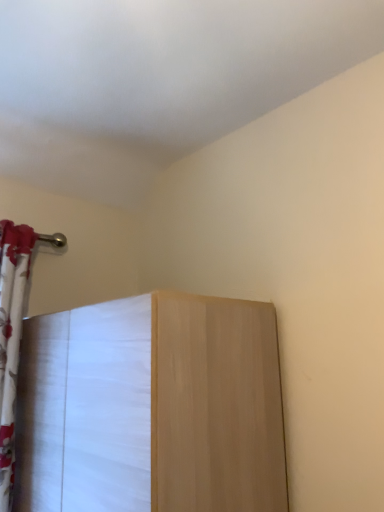
Question: From a real-world perspective, is light wood cabinet at center physically located above or below white floral fabric curtain at left?

Choices:
 (A) above
 (B) below

Answer: (B)

Question: From the image's perspective, is light wood cabinet at center located above or below white floral fabric curtain at left?

Choices:
 (A) below
 (B) above

Answer: (A)

Question: Is light wood cabinet at center situated inside white floral fabric curtain at left or outside?

Choices:
 (A) outside
 (B) inside

Answer: (A)

Question: Considering their positions, is white floral fabric curtain at left located in front of or behind light wood cabinet at center?

Choices:
 (A) behind
 (B) front

Answer: (A)

Question: Based on their positions, is white floral fabric curtain at left located to the left or right of light wood cabinet at center?

Choices:
 (A) left
 (B) right

Answer: (A)

Question: Would you say white floral fabric curtain at left is inside or outside light wood cabinet at center?

Choices:
 (A) inside
 (B) outside

Answer: (B)

Question: Is white floral fabric curtain at left taller or shorter than light wood cabinet at center?

Choices:
 (A) tall
 (B) short

Answer: (A)